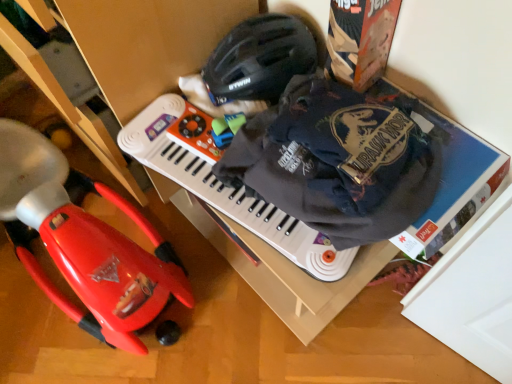
Question: Is white plastic musical keyboard at center taller or shorter than red plastic toy car at left?

Choices:
 (A) short
 (B) tall

Answer: (A)

Question: From a real-world perspective, is white plastic musical keyboard at center physically located above or below red plastic toy car at left?

Choices:
 (A) above
 (B) below

Answer: (A)

Question: Which is nearer to the white plastic musical keyboard at center?

Choices:
 (A) dark blue cotton t-shirt at upper right
 (B) red plastic toy car at left
 (C) black matte helmet at upper center

Answer: (A)

Question: Which object is positioned farthest from the dark blue cotton t-shirt at upper right?

Choices:
 (A) black matte helmet at upper center
 (B) white plastic musical keyboard at center
 (C) red plastic toy car at left

Answer: (C)